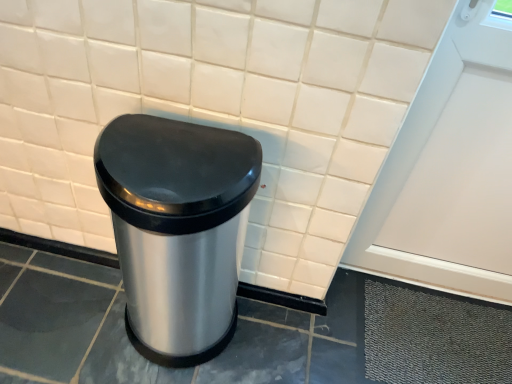
Question: Is satin silver trash can at center oriented away from white matte screen door at upper right?

Choices:
 (A) yes
 (B) no

Answer: (B)

Question: Does satin silver trash can at center have a lesser height compared to white matte screen door at upper right?

Choices:
 (A) yes
 (B) no

Answer: (A)

Question: Considering the relative sizes of satin silver trash can at center and white matte screen door at upper right in the image provided, is satin silver trash can at center wider than white matte screen door at upper right?

Choices:
 (A) no
 (B) yes

Answer: (B)

Question: Is satin silver trash can at center at the left side of white matte screen door at upper right?

Choices:
 (A) yes
 (B) no

Answer: (A)

Question: Does satin silver trash can at center have a smaller size compared to white matte screen door at upper right?

Choices:
 (A) yes
 (B) no

Answer: (B)

Question: Does satin silver trash can at center appear on the right side of white matte screen door at upper right?

Choices:
 (A) yes
 (B) no

Answer: (B)

Question: From the image's perspective, is white matte screen door at upper right above satin silver trash can at center?

Choices:
 (A) yes
 (B) no

Answer: (A)

Question: Does white matte screen door at upper right have a lesser width compared to satin silver trash can at center?

Choices:
 (A) yes
 (B) no

Answer: (A)

Question: From a real-world perspective, is white matte screen door at upper right positioned under satin silver trash can at center based on gravity?

Choices:
 (A) yes
 (B) no

Answer: (B)

Question: Does white matte screen door at upper right have a smaller size compared to satin silver trash can at center?

Choices:
 (A) no
 (B) yes

Answer: (B)

Question: Could you tell me if white matte screen door at upper right is turned towards satin silver trash can at center?

Choices:
 (A) no
 (B) yes

Answer: (A)

Question: Considering the relative sizes of white matte screen door at upper right and satin silver trash can at center in the image provided, is white matte screen door at upper right taller than satin silver trash can at center?

Choices:
 (A) yes
 (B) no

Answer: (A)

Question: Is point (113, 218) closer or farther from the camera than point (393, 273)?

Choices:
 (A) farther
 (B) closer

Answer: (B)